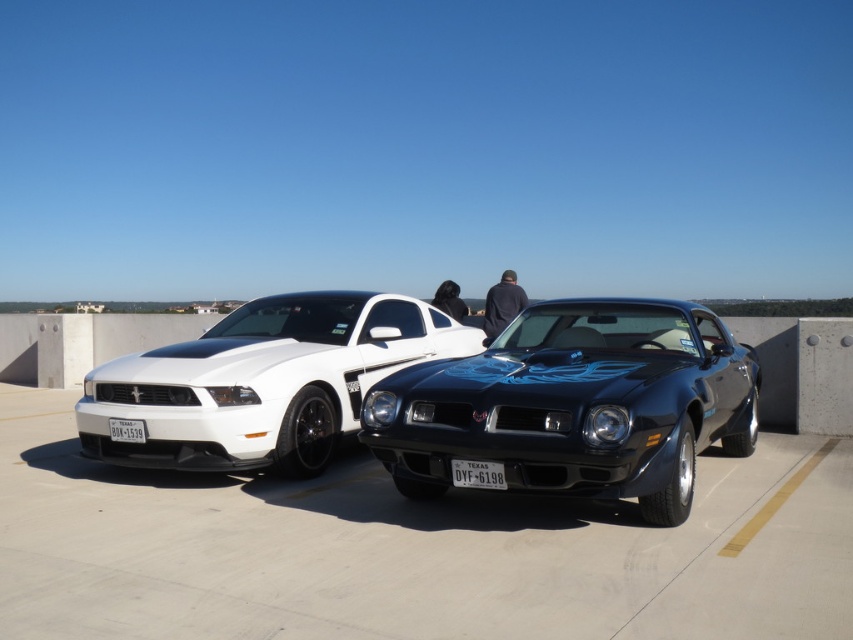
Question: Which of these objects is positioned farthest from the shiny black muscle car at center?

Choices:
 (A) white glossy sports car at left
 (B) black plastic license plate at center
 (C) white plastic license plate at center

Answer: (C)

Question: Among these objects, which one is farthest from the camera?

Choices:
 (A) white glossy sports car at left
 (B) black plastic license plate at center
 (C) white plastic license plate at center

Answer: (C)

Question: Can you confirm if white glossy sports car at left is smaller than black plastic license plate at center?

Choices:
 (A) yes
 (B) no

Answer: (B)

Question: Does shiny black muscle car at center have a smaller size compared to white plastic license plate at center?

Choices:
 (A) no
 (B) yes

Answer: (A)

Question: Considering the relative positions of white glossy sports car at left and white plastic license plate at center in the image provided, where is white glossy sports car at left located with respect to white plastic license plate at center?

Choices:
 (A) left
 (B) right

Answer: (B)

Question: Among these points, which one is farthest from the camera?

Choices:
 (A) (109, 429)
 (B) (180, 406)
 (C) (456, 467)
 (D) (691, 369)

Answer: (A)